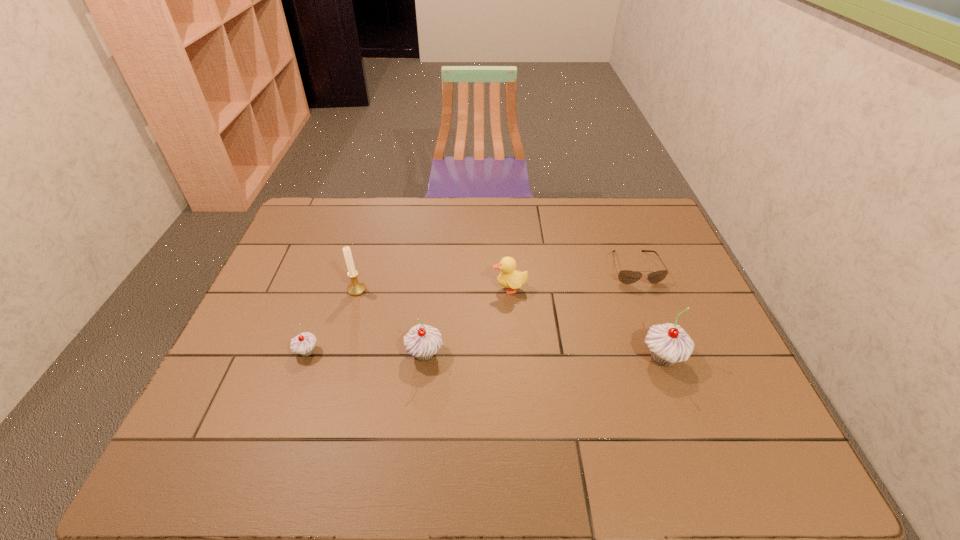
The height and width of the screenshot is (540, 960). What are the coordinates of `blank area located on the back of the rightmost cupcake` in the screenshot? It's located at (636, 285).

The width and height of the screenshot is (960, 540). I want to click on vacant area situated on the front-facing side of the third object from right to left, so (356, 288).

At what (x,y) coordinates should I click in order to perform the action: click on free space located 0.220m on the front-facing side of the third object from right to left. Please return your answer as a coordinate pair (x, y). This screenshot has width=960, height=540. Looking at the image, I should click on (418, 288).

Locate an element on the screen. The image size is (960, 540). vacant point located 0.120m on the front-facing side of the third object from right to left is located at coordinates (451, 288).

Where is `vacant region located 0.390m on the front-facing side of the sunglasses`? This screenshot has width=960, height=540. vacant region located 0.390m on the front-facing side of the sunglasses is located at coordinates (686, 403).

In order to click on vacant area located 0.060m on the right of the candle holder in this screenshot , I will do `click(387, 289)`.

Locate an element on the screen. object that is at the left edge is located at coordinates (303, 344).

Image resolution: width=960 pixels, height=540 pixels. In order to click on cupcake that is at the right edge in this screenshot , I will do `click(668, 343)`.

The image size is (960, 540). Identify the location of sunglasses that is at the right edge. (625, 276).

Image resolution: width=960 pixels, height=540 pixels. In the image, there is a desktop. In order to click on vacant space at the far edge in this screenshot , I will do (512, 231).